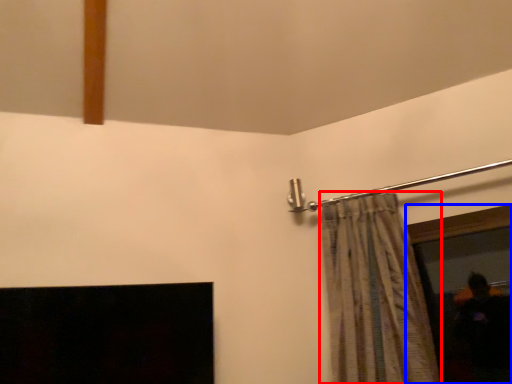
Question: Which object is closer to the camera taking this photo, curtain (highlighted by a red box) or window screen (highlighted by a blue box)?

Choices:
 (A) curtain
 (B) window screen

Answer: (A)